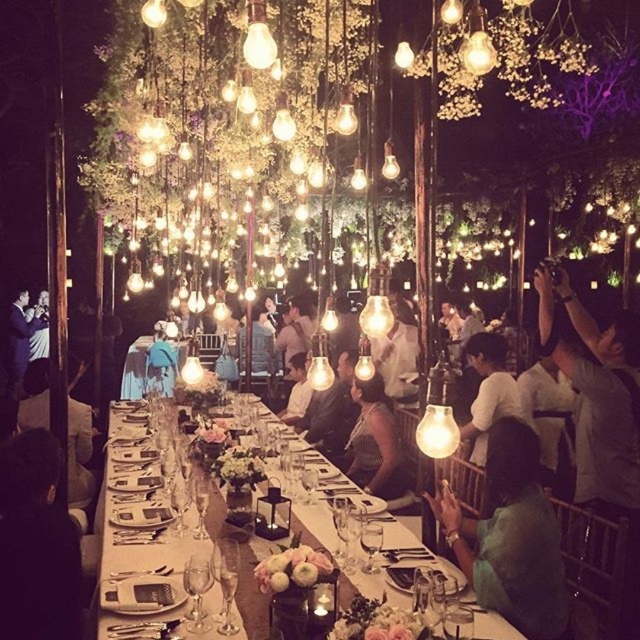
The height and width of the screenshot is (640, 640). Describe the element at coordinates (374, 442) in the screenshot. I see `matte black dress at center` at that location.

Which is more to the right, matte black dress at center or white matte shirt at center?

white matte shirt at center

Find the location of `matte black dress at center`. matte black dress at center is located at coordinates (374, 442).

Is white glossy table at center smaller than matte white shirt at lower right?

Actually, white glossy table at center might be larger than matte white shirt at lower right.

Is white glossy table at center shorter than matte white shirt at lower right?

Indeed, white glossy table at center has a lesser height compared to matte white shirt at lower right.

Is point (509, 637) positioned after point (452, 547)?

No, (509, 637) is in front of (452, 547).

I want to click on white glossy table at center, so click(129, 496).

Which is above, white glossy table at center or matte white shirt at left?

matte white shirt at left

In the scene shown: How distant is white glossy table at center from matte white shirt at left?

white glossy table at center is 7.86 meters away from matte white shirt at left.

Is point (413, 561) positioned in front of point (12, 384)?

Yes, point (413, 561) is closer to viewer.

This screenshot has width=640, height=640. What are the coordinates of `white glossy table at center` in the screenshot? It's located at (129, 496).